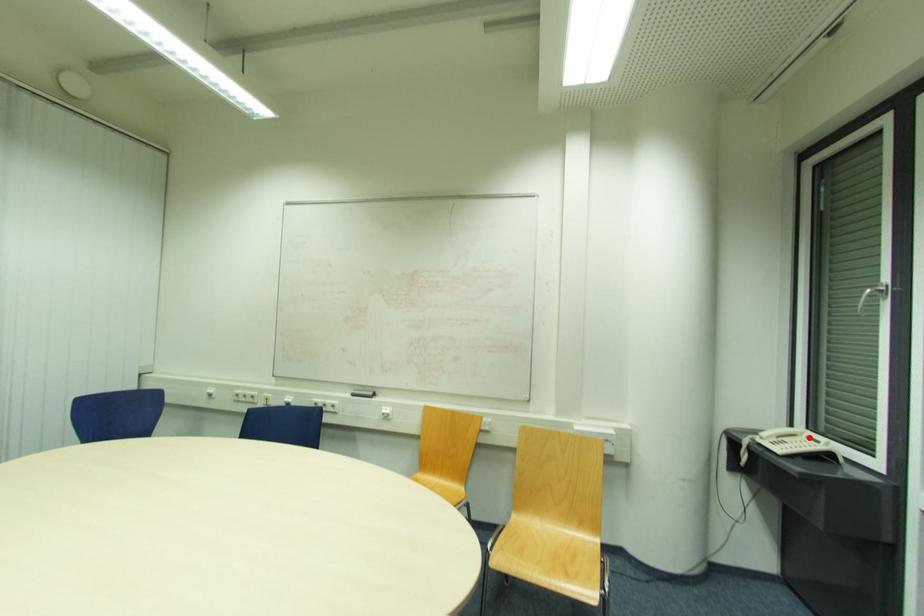
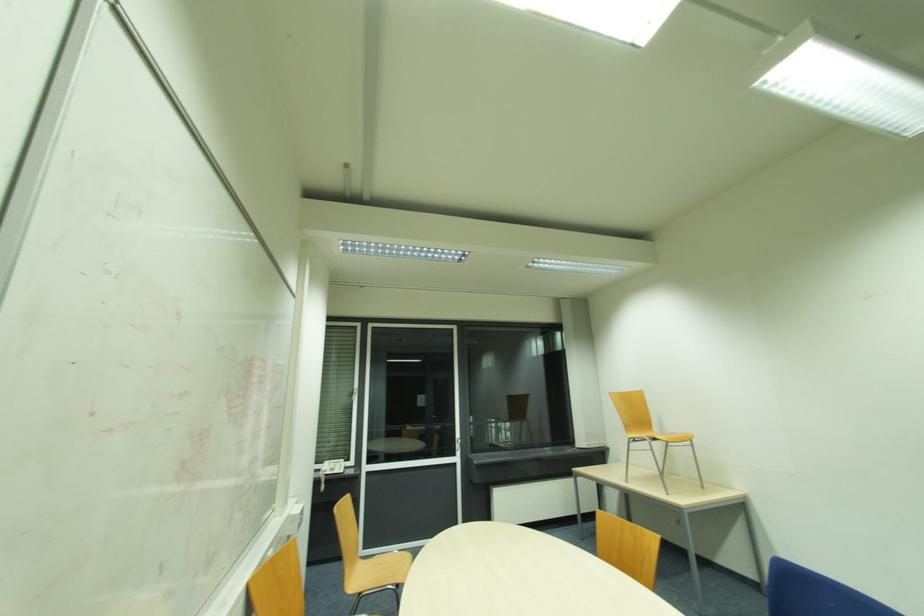
Question: I am providing you with two images of the same scene from different viewpoints. A red point is shown in image1. For the corresponding object point in image2, is it positioned nearer or farther from the camera?

Choices:
 (A) Nearer
 (B) Farther

Answer: (B)